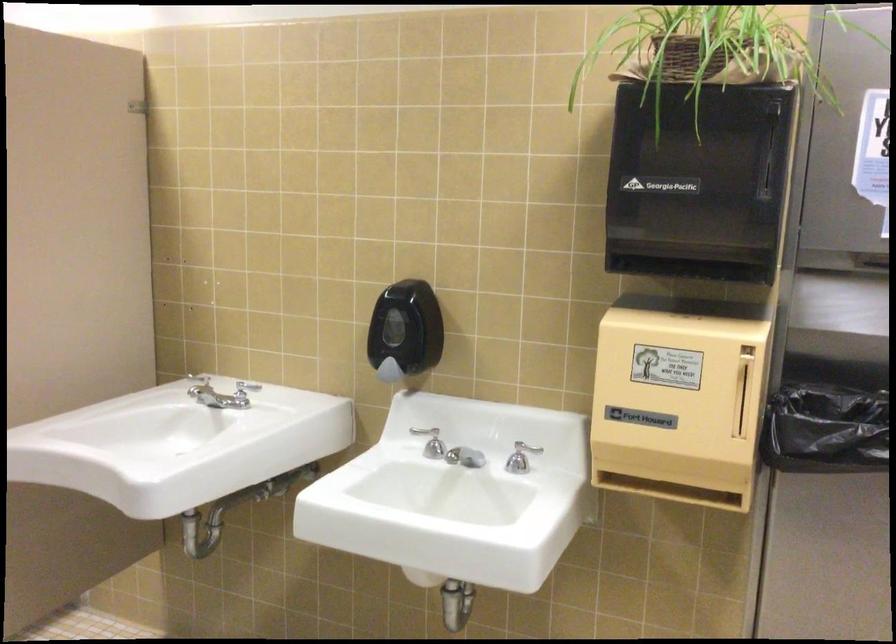
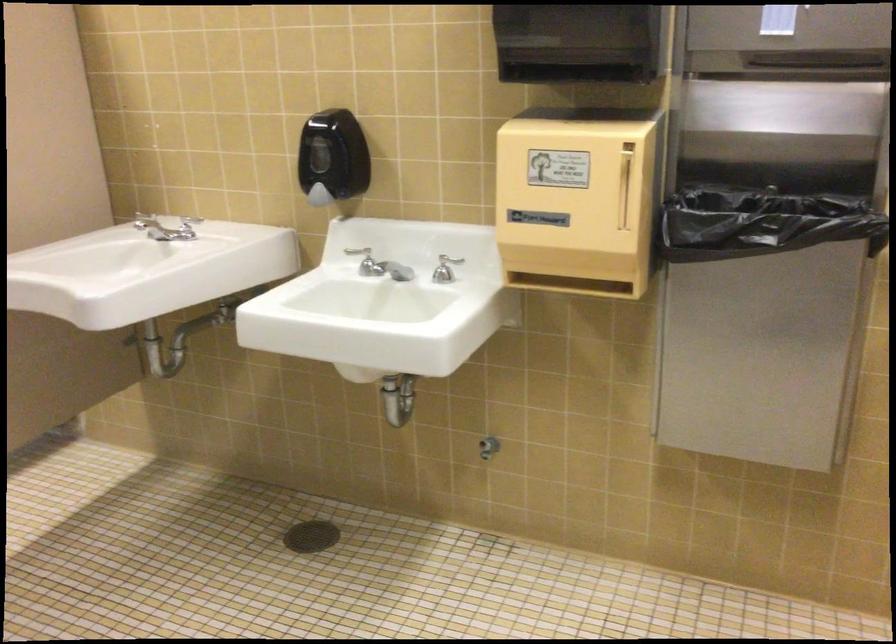
What movement of the cameraman would produce the second image?

The movement direction of the cameraman is right, backward.